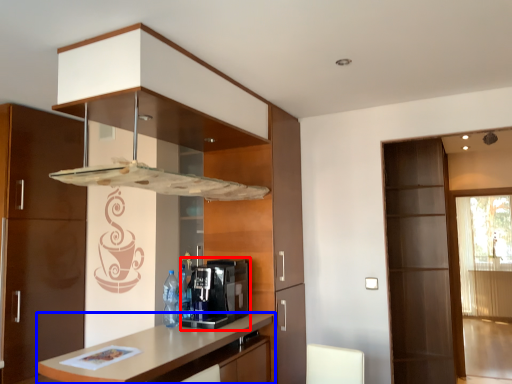
Question: Which object appears closest to the camera in this image, coffee machine (highlighted by a red box) or countertop (highlighted by a blue box)?

Choices:
 (A) coffee machine
 (B) countertop

Answer: (B)